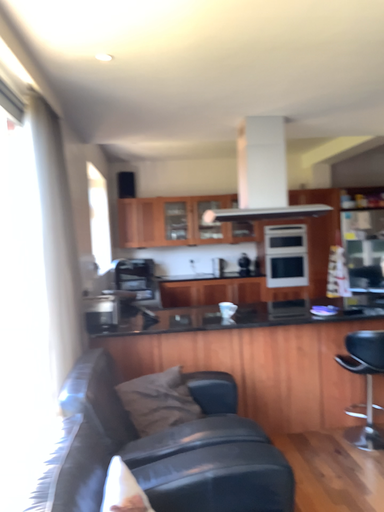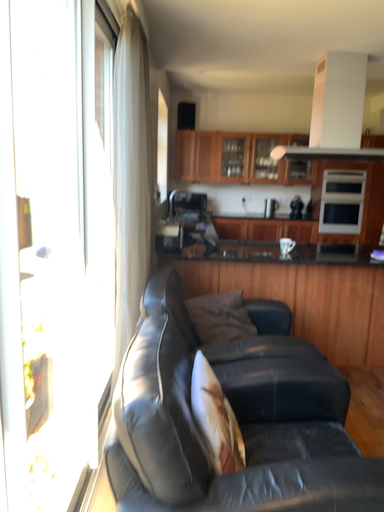
Question: Which way did the camera rotate in the video?

Choices:
 (A) rotated downward
 (B) rotated upward

Answer: (A)